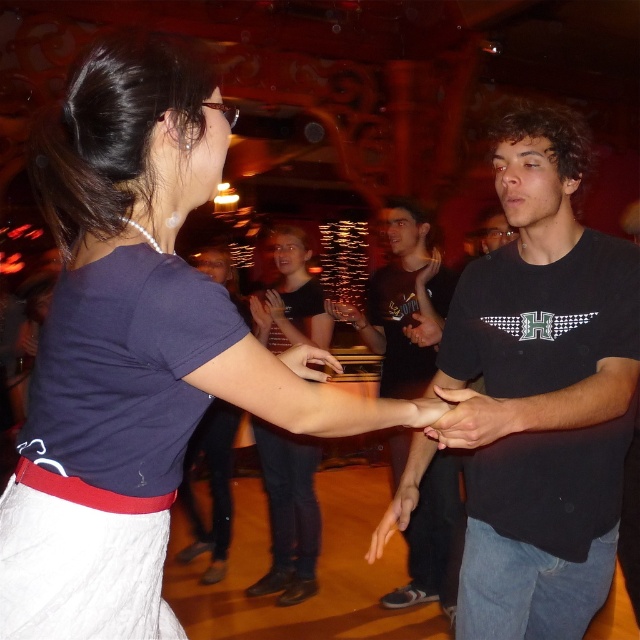
Question: Considering the relative positions of matte blue shirt at center and black cotton shirt at center in the image provided, where is matte blue shirt at center located with respect to black cotton shirt at center?

Choices:
 (A) above
 (B) below

Answer: (A)

Question: Can you confirm if black matte t-shirt at center is positioned below black cotton shirt at center?

Choices:
 (A) no
 (B) yes

Answer: (A)

Question: Which point appears closest to the camera in this image?

Choices:
 (A) (90, 337)
 (B) (566, 154)
 (C) (404, 602)
 (D) (326, 324)

Answer: (A)

Question: Which object appears closest to the camera in this image?

Choices:
 (A) black cotton shirt at center
 (B) matte black shirt at center

Answer: (A)

Question: From the image, what is the correct spatial relationship of black matte t-shirt at center in relation to black cotton shirt at center?

Choices:
 (A) left
 (B) right

Answer: (B)

Question: Which point appears closest to the camera in this image?

Choices:
 (A) (518, 349)
 (B) (424, 577)
 (C) (228, 129)

Answer: (C)